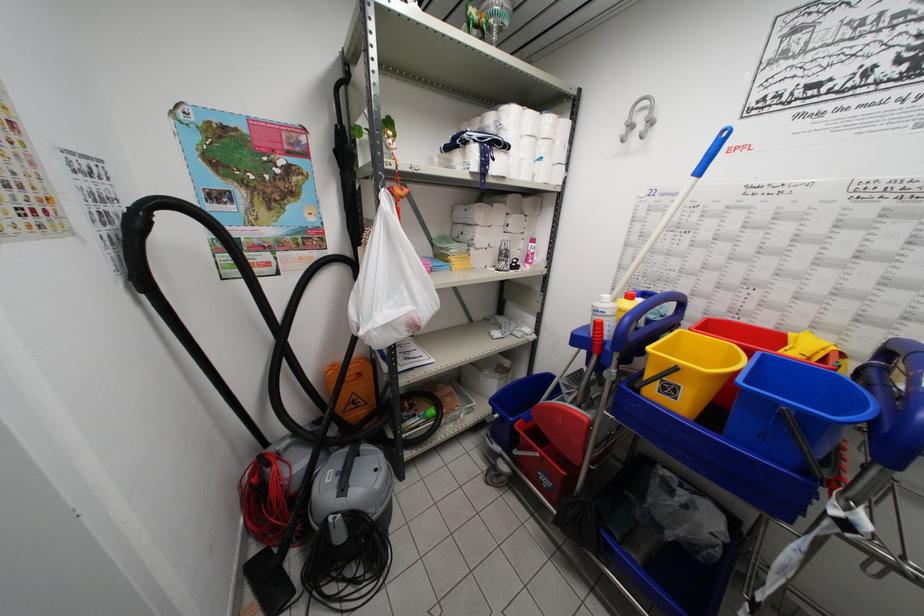
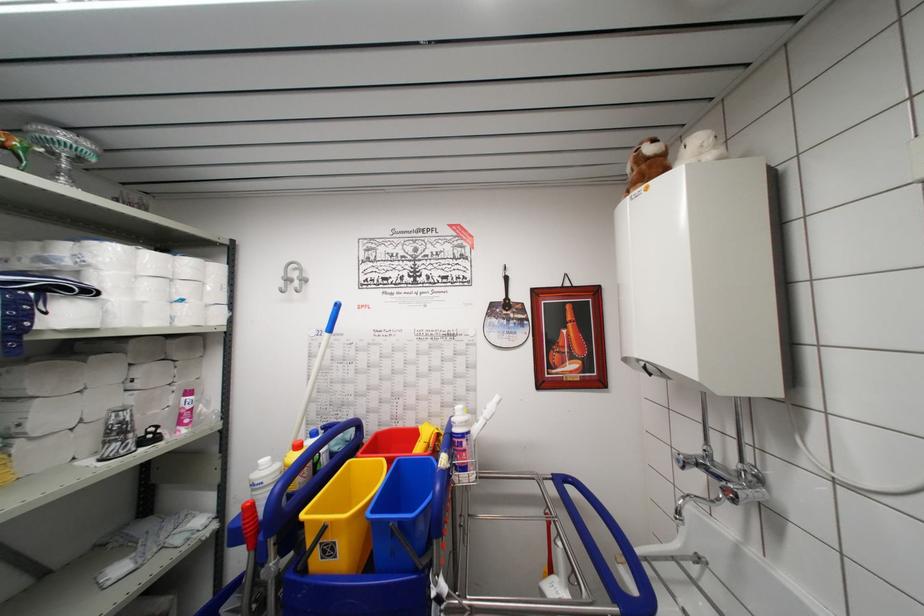
Where in the second image is the point corresponding to (x=837, y=353) from the first image?

(439, 436)